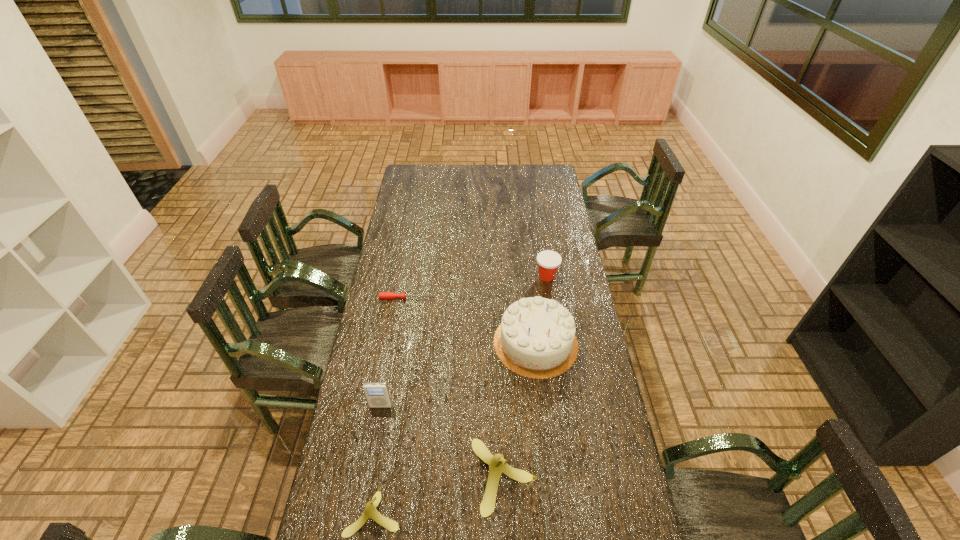
In the image, there is a desktop. Where is `free space at the near edge`? This screenshot has height=540, width=960. free space at the near edge is located at coordinates (462, 531).

Locate an element on the screen. This screenshot has height=540, width=960. vacant area at the left edge is located at coordinates (372, 410).

The width and height of the screenshot is (960, 540). What are the coordinates of `vacant space at the right edge` in the screenshot? It's located at (580, 276).

At what (x,y) coordinates should I click in order to perform the action: click on vacant space at the near right corner. Please return your answer as a coordinate pair (x, y). The height and width of the screenshot is (540, 960). Looking at the image, I should click on (598, 518).

Where is `empty space that is in between the farthest object and the screwdriver`? The width and height of the screenshot is (960, 540). empty space that is in between the farthest object and the screwdriver is located at coordinates (476, 287).

This screenshot has height=540, width=960. Find the location of `empty location between the fifth nearest object and the farthest object`. empty location between the fifth nearest object and the farthest object is located at coordinates tap(476, 287).

At what (x,y) coordinates should I click in order to perform the action: click on free space between the farthest object and the screwdriver. Please return your answer as a coordinate pair (x, y). Looking at the image, I should click on (476, 287).

The height and width of the screenshot is (540, 960). What are the coordinates of `vacant point located between the right banana and the fourth nearest object` in the screenshot? It's located at (520, 409).

Identify the location of free space that is in between the fourth farthest object and the screwdriver. (393, 352).

Locate an element on the screen. The width and height of the screenshot is (960, 540). empty location between the third farthest object and the iPod is located at coordinates (458, 374).